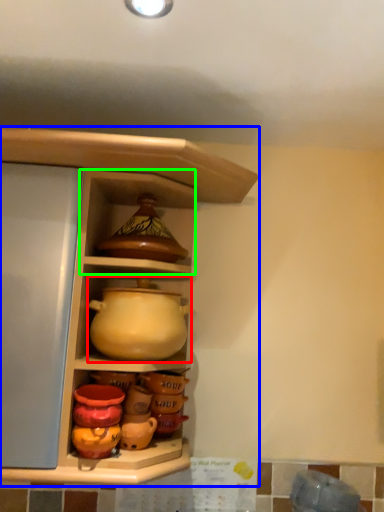
Question: Considering the real-world distances, which object is farthest from jug (highlighted by a red box)? shelf (highlighted by a blue box) or cabinet (highlighted by a green box)?

Choices:
 (A) shelf
 (B) cabinet

Answer: (B)